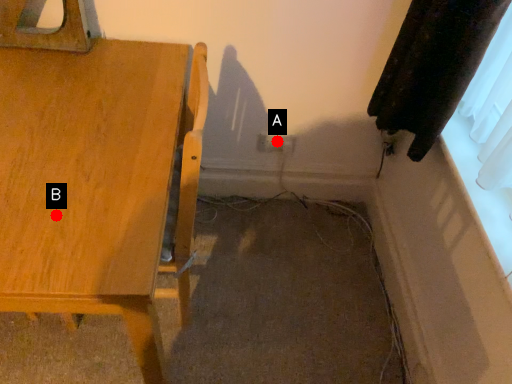
Question: Two points are circled on the image, labeled by A and B beside each circle. Which point is closer to the camera taking this photo?

Choices:
 (A) A is closer
 (B) B is closer

Answer: (B)